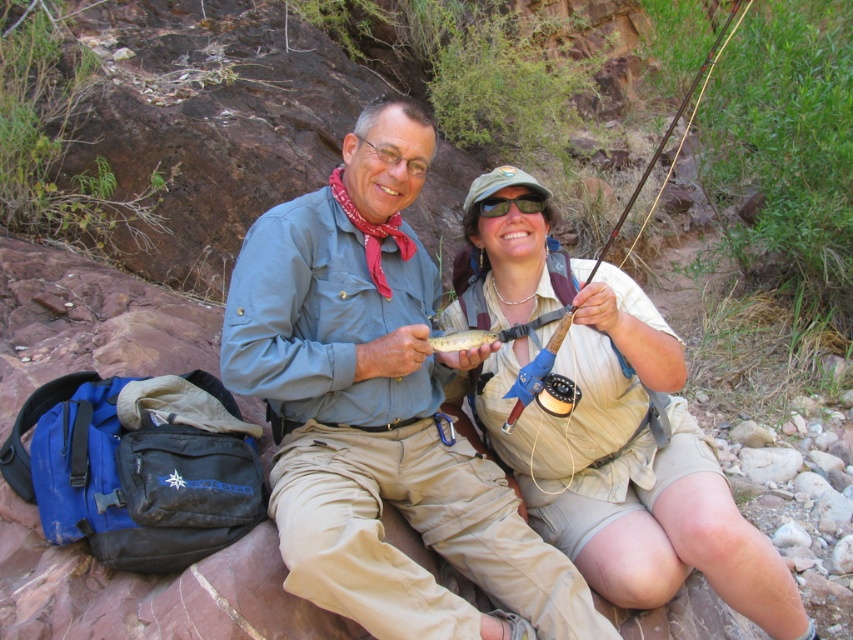
Consider the image. Can you confirm if matte khaki pants at center is positioned to the right of tan fabric shirt at center?

No, matte khaki pants at center is not to the right of tan fabric shirt at center.

Locate an element on the screen. Image resolution: width=853 pixels, height=640 pixels. matte khaki pants at center is located at coordinates (379, 410).

Where is `matte khaki pants at center`? matte khaki pants at center is located at coordinates (379, 410).

Which of these two, tan fabric shirt at center or shiny silver fish at center, stands taller?

Standing taller between the two is tan fabric shirt at center.

Where is `tan fabric shirt at center`? The width and height of the screenshot is (853, 640). tan fabric shirt at center is located at coordinates (605, 422).

Does tan fabric shirt at center have a larger size compared to wooden fly rod at center?

No.

Can you confirm if tan fabric shirt at center is smaller than wooden fly rod at center?

Yes, tan fabric shirt at center is smaller than wooden fly rod at center.

Is point (570, 428) farther from camera compared to point (515, 416)?

Yes.

Where is `tan fabric shirt at center`? tan fabric shirt at center is located at coordinates (605, 422).